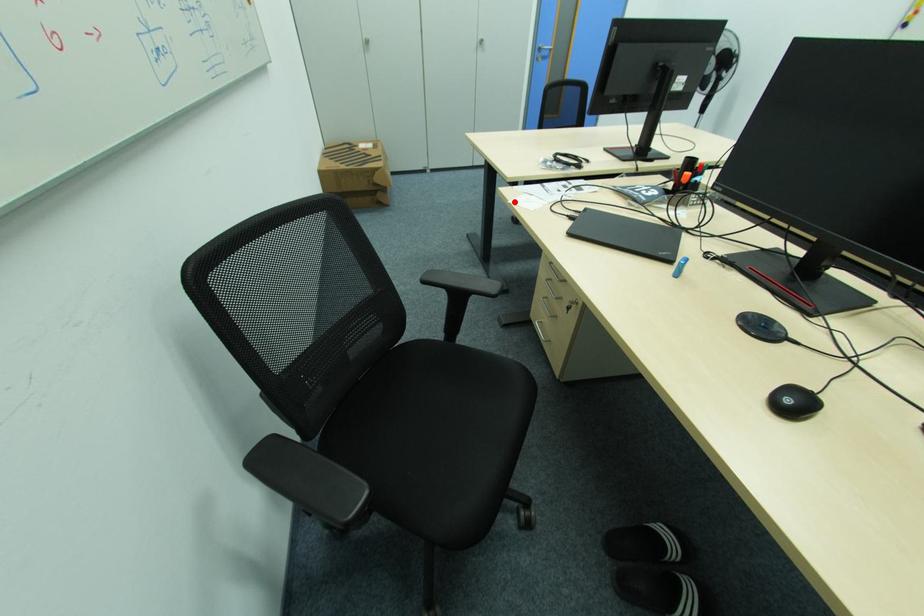
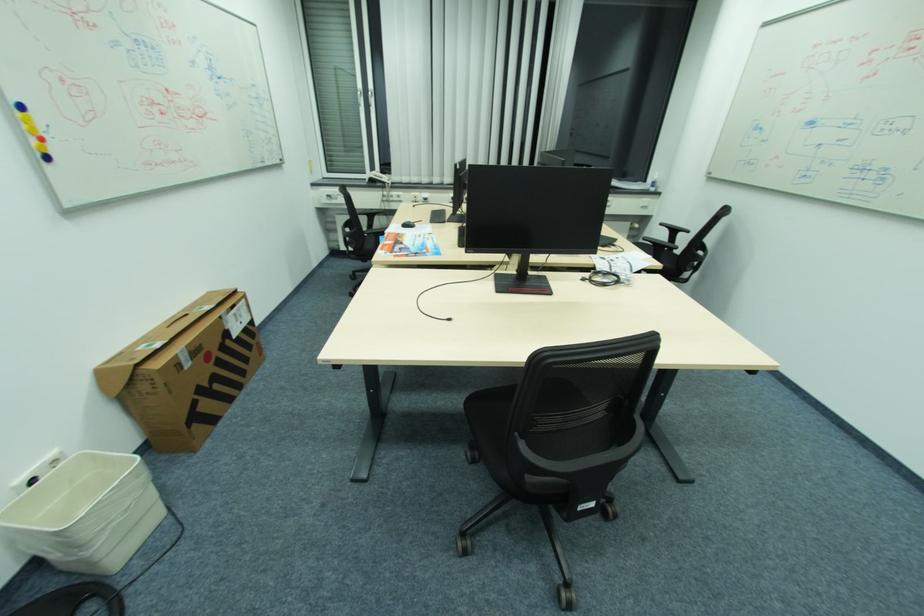
Question: A red point is marked in image1. In image2, is the corresponding 3D point closer to the camera or farther? Reply with the corresponding letter.

Choices:
 (A) The corresponding 3D point is closer.
 (B) The corresponding 3D point is farther.

Answer: (B)